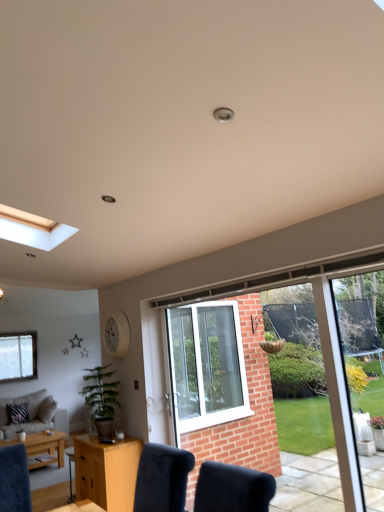
Question: In terms of width, does beige fabric couch at lower left look wider or thinner when compared to light brown wooden coffee table at lower left?

Choices:
 (A) wide
 (B) thin

Answer: (A)

Question: Based on their positions, is beige fabric couch at lower left located to the left or right of light brown wooden coffee table at lower left?

Choices:
 (A) left
 (B) right

Answer: (A)

Question: Which is nearer to the light brown wood desk at lower center?

Choices:
 (A) beige fabric couch at lower left
 (B) green leafy plant at lower left
 (C) clear glass window at lower left, arranged as the first window when viewed from the back
 (D) clear glass window at center, positioned as the second window in left-to-right order
 (E) light brown wooden coffee table at lower left

Answer: (B)

Question: Estimate the real-world distances between objects in this image. Which object is farther from the light brown wood desk at lower center?

Choices:
 (A) clear glass window at center, acting as the 1th window starting from the right
 (B) beige fabric couch at lower left
 (C) green leafy plant at lower left
 (D) light brown wooden coffee table at lower left
 (E) clear glass window at lower left, the first window positioned from the left

Answer: (E)